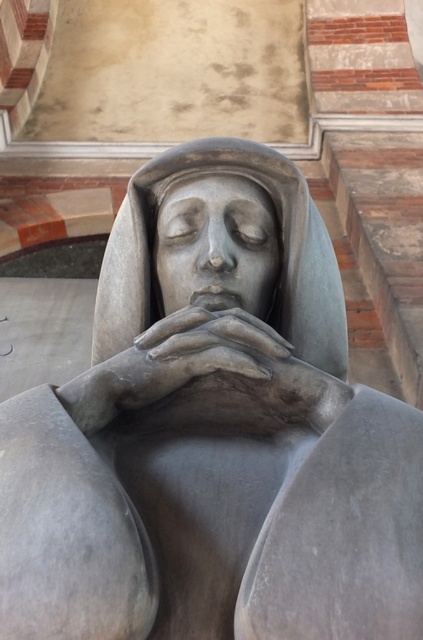
Question: Estimate the real-world distances between objects in this image. Which object is farther from the satin gray statue at center?

Choices:
 (A) matte gray sculpture at center
 (B) matte gray hands at center

Answer: (B)

Question: Does satin gray statue at center come in front of matte gray hands at center?

Choices:
 (A) no
 (B) yes

Answer: (A)

Question: Which object is farther from the camera taking this photo?

Choices:
 (A) matte gray sculpture at center
 (B) matte gray hands at center
 (C) satin gray statue at center

Answer: (A)

Question: Does matte gray hands at center have a smaller size compared to matte gray sculpture at center?

Choices:
 (A) no
 (B) yes

Answer: (A)

Question: Can you confirm if satin gray statue at center is positioned to the left of matte gray sculpture at center?

Choices:
 (A) no
 (B) yes

Answer: (B)

Question: Which point is farther from the camera taking this photo?

Choices:
 (A) (302, 240)
 (B) (208, 205)

Answer: (A)